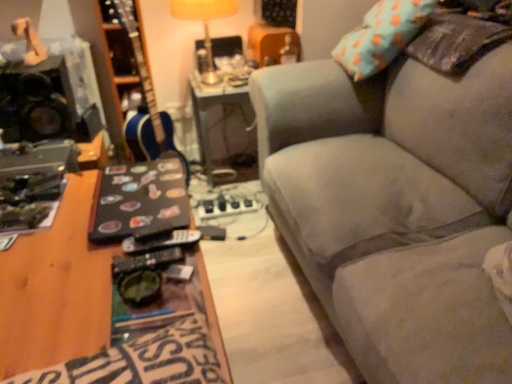
At what (x,y) coordinates should I click in order to perform the action: click on vacant space in yellow fabric lampshade at upper center (from a real-world perspective). Please return your answer as a coordinate pair (x, y). This screenshot has width=512, height=384. Looking at the image, I should click on (215, 80).